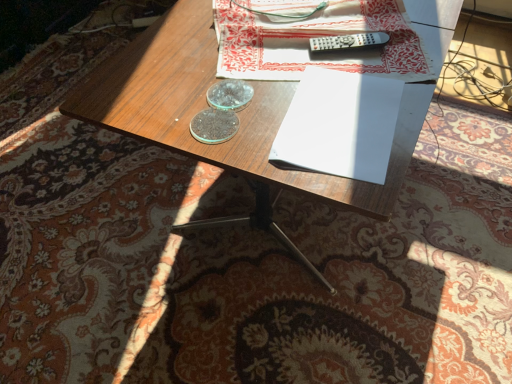
At what (x,y) coordinates should I click in order to perform the action: click on unoccupied region to the right of wooden desk at center. Please return your answer as a coordinate pair (x, y). Looking at the image, I should click on (465, 148).